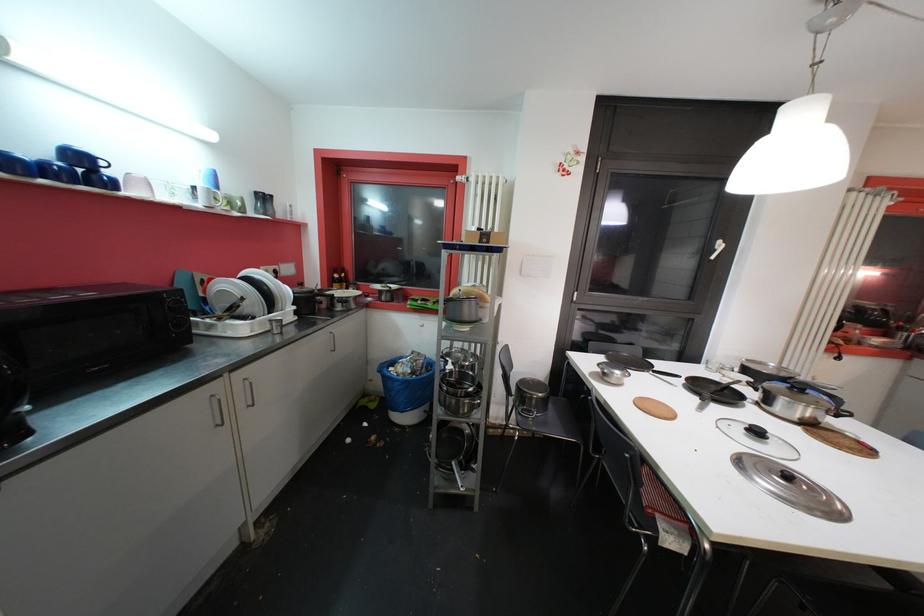
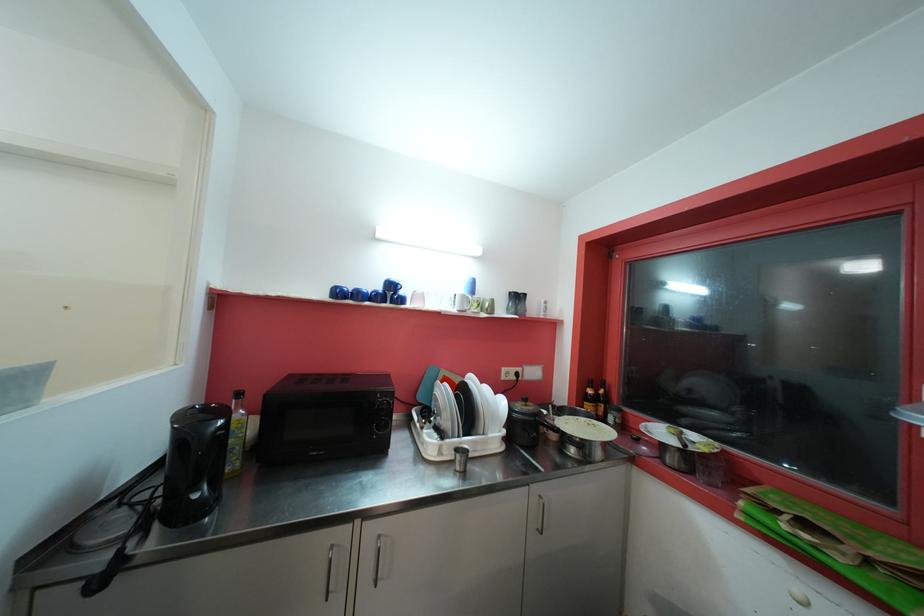
The point at (x=86, y=161) is marked in the first image. Where is the corresponding point in the second image?

(396, 288)